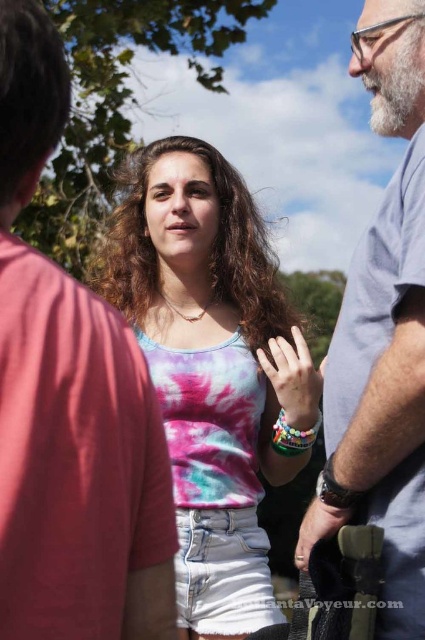
Based on the scene description, where exactly is the gray fabric shirt at center located in terms of coordinates?

The gray fabric shirt at center is located at point coordinates of 0.633 in the x axis and 0.165 in the y axis.